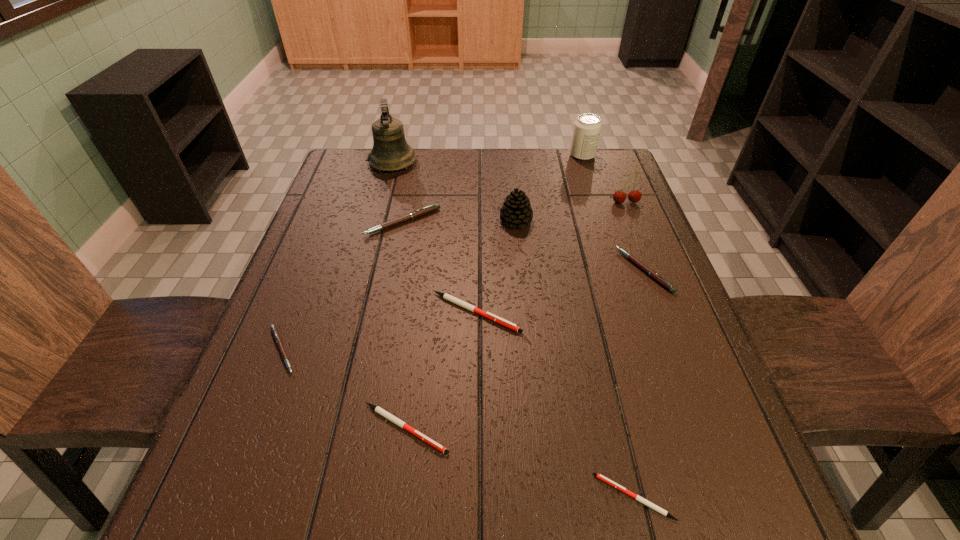
In the image, there is a desktop. At what (x,y) coordinates should I click in order to perform the action: click on free space at the far edge. Please return your answer as a coordinate pair (x, y). Looking at the image, I should click on (516, 158).

Identify the location of vacant space at the near edge. The image size is (960, 540). (405, 494).

Where is `vacant space at the left edge`? This screenshot has width=960, height=540. vacant space at the left edge is located at coordinates (300, 333).

Find the location of a particular element. This screenshot has height=540, width=960. vacant area at the right edge is located at coordinates (706, 431).

This screenshot has width=960, height=540. I want to click on free space at the near left corner of the desktop, so click(x=202, y=481).

This screenshot has height=540, width=960. What are the coordinates of `free space at the near right corner of the desktop` in the screenshot? It's located at (717, 539).

Where is `unoccupied position between the pinecone and the tallest object`? The image size is (960, 540). unoccupied position between the pinecone and the tallest object is located at coordinates (454, 192).

At what (x,y) coordinates should I click in order to perform the action: click on vacant space that's between the eighth nearest object and the farthest white pen. Please return your answer as a coordinate pair (x, y). This screenshot has width=960, height=540. Looking at the image, I should click on (551, 258).

Where is `vacant space that is in between the rightmost white pen and the second tallest object`? vacant space that is in between the rightmost white pen and the second tallest object is located at coordinates (609, 326).

Identify the location of free space between the nearest pink pen and the ninth shortest object. (432, 253).